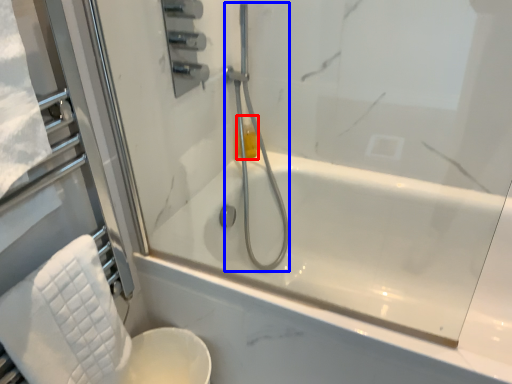
Question: Which point is further to the camera, toiletry (highlighted by a red box) or shower (highlighted by a blue box)?

Choices:
 (A) toiletry
 (B) shower

Answer: (A)